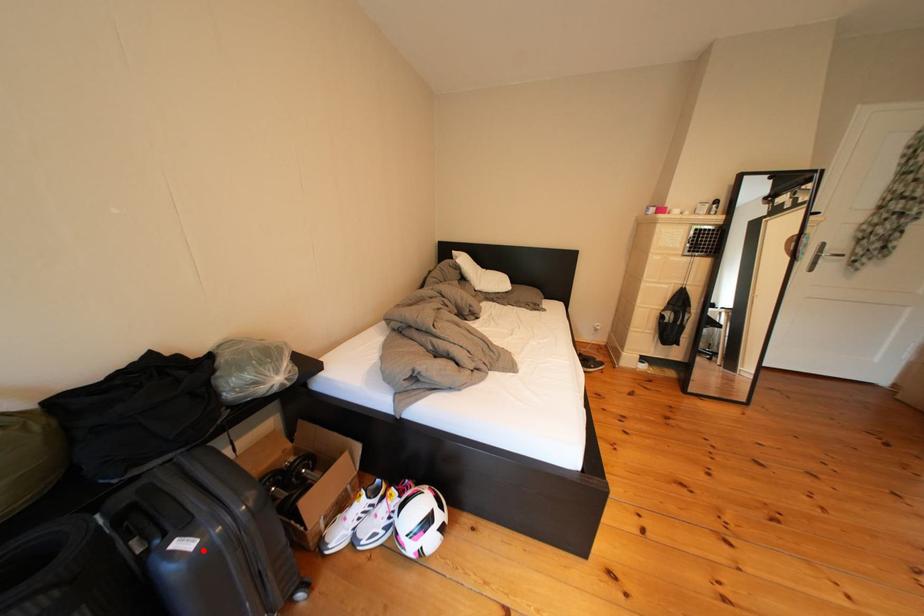
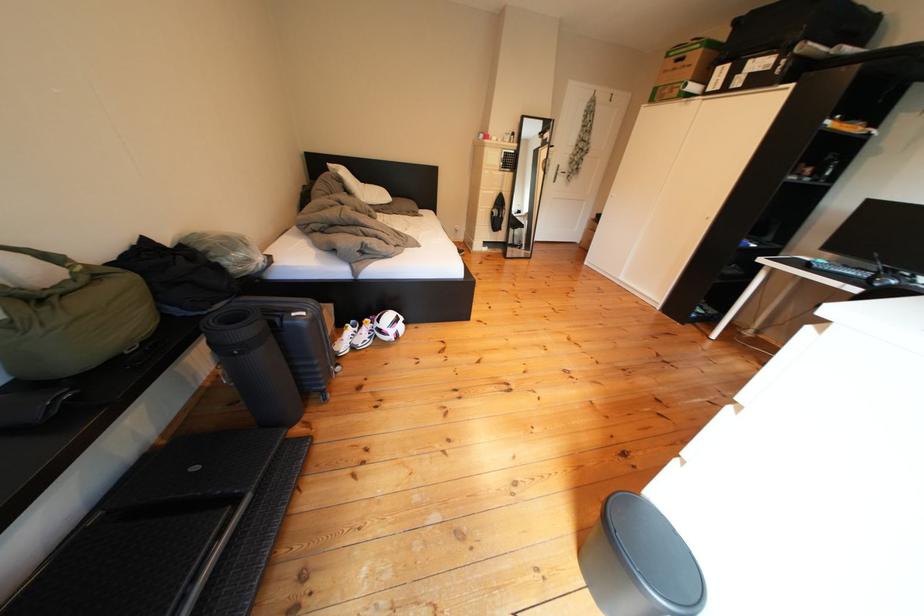
Question: I am providing you with two images of the same scene from different viewpoints. Given a red point in image1, look at the same physical point in image2. Is it:

Choices:
 (A) Closer to the viewpoint
 (B) Farther from the viewpoint

Answer: (A)